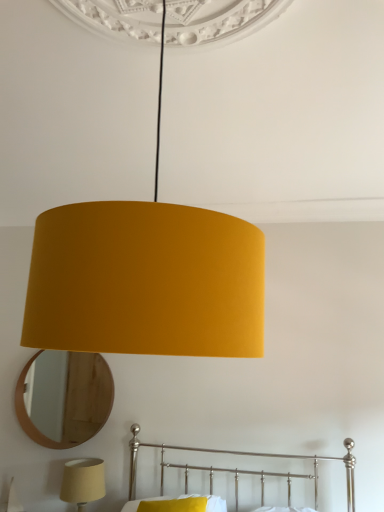
Identify the location of metallic silver bed at lower center. (241, 468).

This screenshot has width=384, height=512. I want to click on matte yellow fabric lampshade at center, marked as the second lamp in a back-to-front arrangement, so click(145, 279).

At what (x,y) coordinates should I click in order to perform the action: click on yellow fabric pillow at lower center. Please return your answer as a coordinate pair (x, y). This screenshot has height=512, width=384. Looking at the image, I should click on (174, 505).

Locate an element on the screen. wooden mirror at lower left is located at coordinates (64, 397).

Based on the photo, from a real-world perspective, is wooden mirror at lower left above or below matte yellow fabric lampshade at center, the second lamp when ordered from bottom to top?

wooden mirror at lower left is situated lower than matte yellow fabric lampshade at center, the second lamp when ordered from bottom to top, in the real world.

Is wooden mirror at lower left next to matte yellow fabric lampshade at center, marked as the second lamp in a back-to-front arrangement?

No, wooden mirror at lower left is not with matte yellow fabric lampshade at center, marked as the second lamp in a back-to-front arrangement.

Is point (55, 446) farther from camera compared to point (240, 245)?

Yes.

Locate an element on the screen. The width and height of the screenshot is (384, 512). lamp above the wooden mirror at lower left (from a real-world perspective) is located at coordinates (145, 279).

What's the angular difference between matte yellow fabric lampshade at center, the second lamp when ordered from bottom to top, and wooden mirror at lower left's facing directions?

The angle between the facing direction of matte yellow fabric lampshade at center, the second lamp when ordered from bottom to top, and the facing direction of wooden mirror at lower left is 94.1 degrees.

Which is more to the left, matte yellow fabric lampshade at center, which is the second lamp from left to right, or wooden mirror at lower left?

From the viewer's perspective, wooden mirror at lower left appears more on the left side.

Which point is more forward, (190, 305) or (45, 356)?

The point (190, 305) is in front.

From a real-world perspective, is matte yellow fabric lampshade at center, the second lamp when ordered from bottom to top, physically located above or below yellow fabric pillow at lower center?

From a real-world perspective, matte yellow fabric lampshade at center, the second lamp when ordered from bottom to top, is physically above yellow fabric pillow at lower center.

Is matte yellow fabric lampshade at center, which is the second lamp from left to right, at the left side of yellow fabric pillow at lower center?

No, matte yellow fabric lampshade at center, which is the second lamp from left to right, is not to the left of yellow fabric pillow at lower center.

Which is behind, matte yellow fabric lampshade at center, which is the first lamp from top to bottom, or yellow fabric pillow at lower center?

yellow fabric pillow at lower center is further from the camera.

From the picture: Does yellow fabric pillow at lower center appear on the right side of matte yellow lampshade at lower left, which is counted as the 1th lamp, starting from the back?

Yes.

Is point (176, 499) closer to camera compared to point (88, 497)?

No, it is not.

Is matte yellow lampshade at lower left, which is the second lamp in top-to-bottom order, located within yellow fabric pillow at lower center?

No, matte yellow lampshade at lower left, which is the second lamp in top-to-bottom order, is not inside yellow fabric pillow at lower center.

Can you tell me how much yellow fabric pillow at lower center and matte yellow lampshade at lower left, which is the second lamp in front-to-back order, differ in facing direction?

The angle between the facing direction of yellow fabric pillow at lower center and the facing direction of matte yellow lampshade at lower left, which is the second lamp in front-to-back order, is 7.03 degrees.

From the image's perspective, which is above, yellow fabric pillow at lower center or wooden mirror at lower left?

wooden mirror at lower left.

How distant is yellow fabric pillow at lower center from wooden mirror at lower left?

yellow fabric pillow at lower center is 38.69 inches from wooden mirror at lower left.

Between yellow fabric pillow at lower center and wooden mirror at lower left, which one has less height?

Standing shorter between the two is yellow fabric pillow at lower center.

Find the location of `pillow in front of the wooden mirror at lower left`. pillow in front of the wooden mirror at lower left is located at coordinates (174, 505).

Is wooden mirror at lower left looking in the opposite direction of metallic silver bed at lower center?

wooden mirror at lower left does not have its back to metallic silver bed at lower center.

How much distance is there between wooden mirror at lower left and metallic silver bed at lower center?

wooden mirror at lower left and metallic silver bed at lower center are 28.36 inches apart from each other.

Would you say wooden mirror at lower left is a long distance from metallic silver bed at lower center?

No, wooden mirror at lower left is in close proximity to metallic silver bed at lower center.

Locate an element on the screen. This screenshot has height=512, width=384. bed to the right of wooden mirror at lower left is located at coordinates (241, 468).

Is matte yellow fabric lampshade at center, marked as the first lamp in a right-to-left arrangement, facing towards metallic silver bed at lower center?

No, matte yellow fabric lampshade at center, marked as the first lamp in a right-to-left arrangement, is not oriented towards metallic silver bed at lower center.

Is point (166, 331) farther from viewer compared to point (134, 460)?

No, it is in front of (134, 460).

Considering the positions of objects matte yellow fabric lampshade at center, which is the first lamp from top to bottom, and metallic silver bed at lower center in the image provided, who is behind, matte yellow fabric lampshade at center, which is the first lamp from top to bottom, or metallic silver bed at lower center?

metallic silver bed at lower center is more distant.

Who is taller, matte yellow fabric lampshade at center, marked as the first lamp in a front-to-back arrangement, or metallic silver bed at lower center?

With more height is matte yellow fabric lampshade at center, marked as the first lamp in a front-to-back arrangement.

There is a wooden mirror at lower left. In order to click on lamp above it (from a real-world perspective) in this screenshot , I will do `click(145, 279)`.

Find the location of a particular element. This screenshot has width=384, height=512. mirror that appears on the left of matte yellow fabric lampshade at center, marked as the first lamp in a front-to-back arrangement is located at coordinates (64, 397).

When comparing their distances from yellow fabric pillow at lower center, does wooden mirror at lower left or metallic silver bed at lower center seem further?

wooden mirror at lower left.

From the image, which object appears to be nearer to metallic silver bed at lower center, yellow fabric pillow at lower center or matte yellow fabric lampshade at center, marked as the first lamp in a front-to-back arrangement?

Based on the image, yellow fabric pillow at lower center appears to be nearer to metallic silver bed at lower center.

Looking at this image, estimate the real-world distances between objects in this image. Which object is further from wooden mirror at lower left, matte yellow fabric lampshade at center, which is the second lamp from left to right, or yellow fabric pillow at lower center?

matte yellow fabric lampshade at center, which is the second lamp from left to right, lies further to wooden mirror at lower left than the other object.

Considering their positions, is wooden mirror at lower left positioned further to matte yellow lampshade at lower left, which appears as the 1th lamp when viewed from the left, than matte yellow fabric lampshade at center, marked as the second lamp in a back-to-front arrangement?

Among the two, matte yellow fabric lampshade at center, marked as the second lamp in a back-to-front arrangement, is located further to matte yellow lampshade at lower left, which appears as the 1th lamp when viewed from the left.

Considering their positions, is matte yellow lampshade at lower left, which appears as the 1th lamp when viewed from the left, positioned closer to yellow fabric pillow at lower center than matte yellow fabric lampshade at center, marked as the first lamp in a right-to-left arrangement?

matte yellow lampshade at lower left, which appears as the 1th lamp when viewed from the left, lies closer to yellow fabric pillow at lower center than the other object.

Which object lies further to the anchor point matte yellow fabric lampshade at center, marked as the first lamp in a front-to-back arrangement, wooden mirror at lower left or matte yellow lampshade at lower left, which is the second lamp in top-to-bottom order?

matte yellow lampshade at lower left, which is the second lamp in top-to-bottom order, is positioned further to the anchor matte yellow fabric lampshade at center, marked as the first lamp in a front-to-back arrangement.

Which object lies further to the anchor point matte yellow lampshade at lower left, which is the second lamp in top-to-bottom order, metallic silver bed at lower center or wooden mirror at lower left?

metallic silver bed at lower center is further to matte yellow lampshade at lower left, which is the second lamp in top-to-bottom order.

From the image, which object appears to be nearer to matte yellow lampshade at lower left, which is counted as the 1th lamp, starting from the back, yellow fabric pillow at lower center or wooden mirror at lower left?

Based on the image, yellow fabric pillow at lower center appears to be nearer to matte yellow lampshade at lower left, which is counted as the 1th lamp, starting from the back.

Find the location of `bed positioned between matte yellow fabric lampshade at center, marked as the first lamp in a right-to-left arrangement, and matte yellow lampshade at lower left, which is the second lamp in top-to-bottom order, from near to far`. bed positioned between matte yellow fabric lampshade at center, marked as the first lamp in a right-to-left arrangement, and matte yellow lampshade at lower left, which is the second lamp in top-to-bottom order, from near to far is located at coordinates (241, 468).

Identify the location of bed between matte yellow fabric lampshade at center, which is the second lamp from left to right, and wooden mirror at lower left from front to back. (241, 468).

You are a GUI agent. You are given a task and a screenshot of the screen. Output one action in this format:
    pyautogui.click(x=<x>, y=<y>)
    Task: Click on the bed between matte yellow fabric lampshade at center, which is the first lamp from top to bottom, and yellow fabric pillow at lower center in the up-down direction
    
    Given the screenshot: What is the action you would take?
    pyautogui.click(x=241, y=468)

Identify the location of pillow positioned between metallic silver bed at lower center and wooden mirror at lower left from near to far. (174, 505).